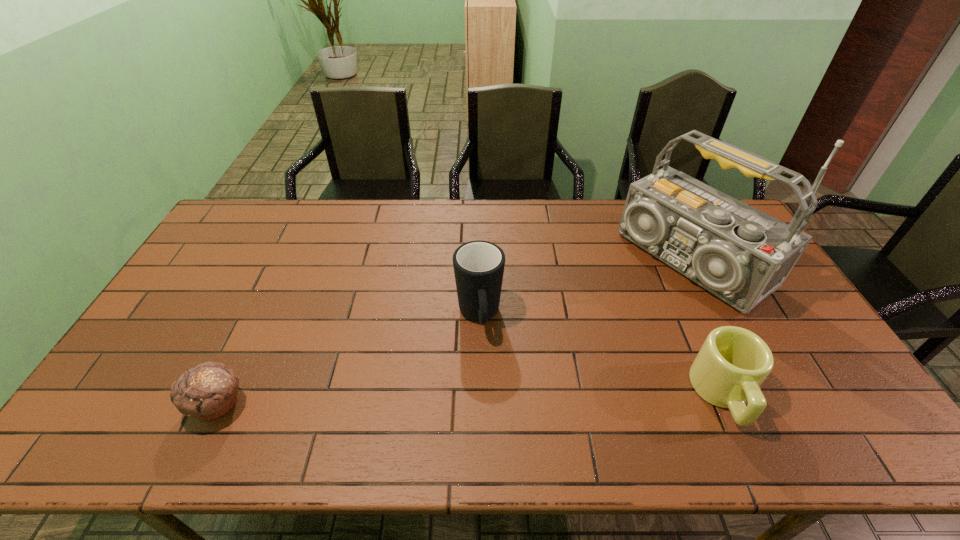
In order to click on vacant area located on the front-facing side of the tallest object in this screenshot , I will do `click(632, 304)`.

Locate an element on the screen. The height and width of the screenshot is (540, 960). free space located on the side of the taller mug with the handle is located at coordinates (488, 389).

The width and height of the screenshot is (960, 540). What are the coordinates of `free spot located on the side of the taller mug with the handle` in the screenshot? It's located at (490, 399).

Identify the location of free location located 0.060m on the side of the taller mug with the handle. The height and width of the screenshot is (540, 960). (484, 362).

Locate an element on the screen. object located in the far edge section of the desktop is located at coordinates (740, 254).

The height and width of the screenshot is (540, 960). What are the coordinates of `muffin at the near edge` in the screenshot? It's located at (208, 391).

Locate an element on the screen. The image size is (960, 540). mug at the near edge is located at coordinates (733, 362).

This screenshot has width=960, height=540. In order to click on object that is positioned at the right edge in this screenshot , I will do `click(740, 254)`.

This screenshot has height=540, width=960. Identify the location of object that is at the far right corner. (740, 254).

Locate an element on the screen. vacant point at the far edge is located at coordinates [454, 204].